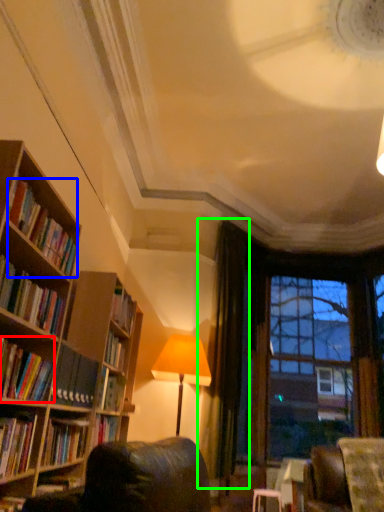
Question: Which object is positioned closest to book (highlighted by a red box)? Select from book (highlighted by a blue box) and curtain (highlighted by a green box).

Choices:
 (A) book
 (B) curtain

Answer: (A)